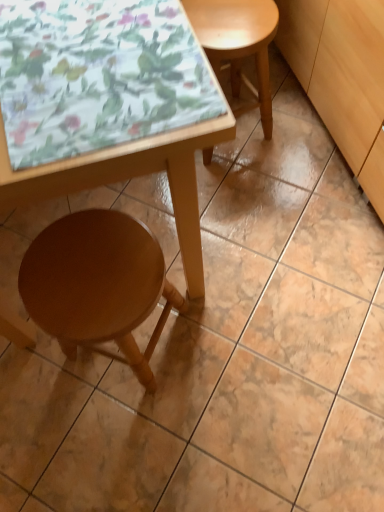
Question: Can you confirm if wooden table at lower left is shorter than light wood cabinet at lower right?

Choices:
 (A) no
 (B) yes

Answer: (A)

Question: From the image's perspective, is wooden table at lower left beneath light wood cabinet at lower right?

Choices:
 (A) no
 (B) yes

Answer: (B)

Question: Does wooden table at lower left have a smaller size compared to light wood cabinet at lower right?

Choices:
 (A) no
 (B) yes

Answer: (A)

Question: Is wooden table at lower left at the right side of light wood cabinet at lower right?

Choices:
 (A) no
 (B) yes

Answer: (A)

Question: From a real-world perspective, is wooden table at lower left positioned under light wood cabinet at lower right based on gravity?

Choices:
 (A) yes
 (B) no

Answer: (B)

Question: Is point (382, 35) positioned closer to the camera than point (228, 54)?

Choices:
 (A) farther
 (B) closer

Answer: (B)

Question: Is light wood cabinet at lower right taller or shorter than light brown wood stool at upper right, the first stool viewed from the top?

Choices:
 (A) short
 (B) tall

Answer: (B)

Question: Would you say light wood cabinet at lower right is inside or outside light brown wood stool at upper right, the first stool viewed from the top?

Choices:
 (A) inside
 (B) outside

Answer: (B)

Question: Considering the positions of light wood cabinet at lower right and light brown wood stool at upper right, the first stool viewed from the top, in the image, is light wood cabinet at lower right bigger or smaller than light brown wood stool at upper right, the first stool viewed from the top,?

Choices:
 (A) small
 (B) big

Answer: (B)

Question: Based on their sizes in the image, would you say light brown wood stool at upper right, which is the second stool from left to right, is bigger or smaller than wooden stool at lower left, the 2th stool when ordered from right to left?

Choices:
 (A) big
 (B) small

Answer: (B)

Question: Relative to wooden stool at lower left, acting as the 1th stool starting from the bottom, is light brown wood stool at upper right, arranged as the second stool when ordered from the bottom, in front or behind?

Choices:
 (A) behind
 (B) front

Answer: (A)

Question: Does point (243, 44) appear closer or farther from the camera than point (147, 260)?

Choices:
 (A) closer
 (B) farther

Answer: (B)

Question: Based on their positions, is light brown wood stool at upper right, placed as the 1th stool when sorted from right to left, located to the left or right of wooden stool at lower left, the first stool viewed from the left?

Choices:
 (A) right
 (B) left

Answer: (A)

Question: Is point (102, 74) closer or farther from the camera than point (339, 34)?

Choices:
 (A) closer
 (B) farther

Answer: (A)

Question: In terms of width, does wooden table at lower left look wider or thinner when compared to light wood cabinet at lower right?

Choices:
 (A) wide
 (B) thin

Answer: (A)